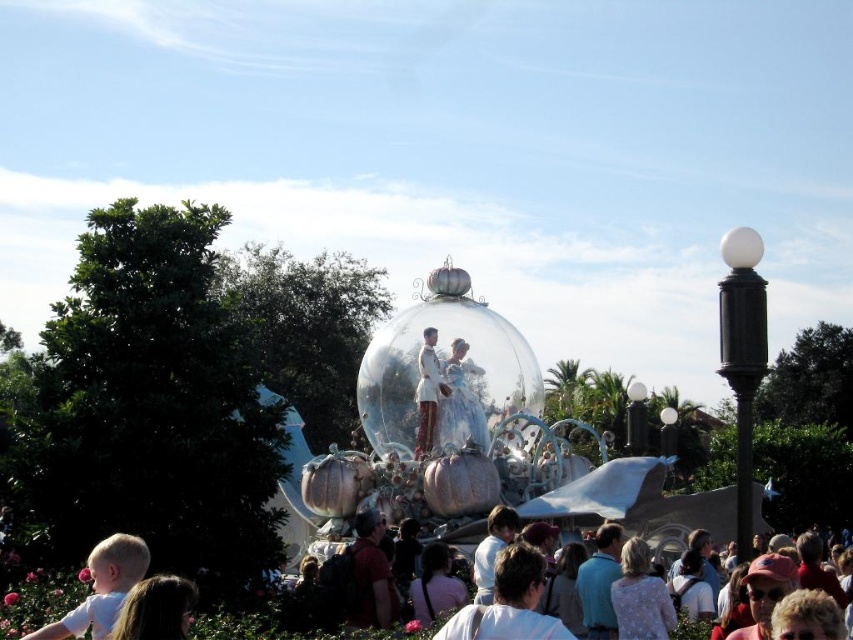
You are standing in the crowd at the theme park and notice two items at the center. Which item is closer to you between the white cotton shirt at center and the matte red backpack at center?

The white cotton shirt at center is closer to you since it is in front of the matte red backpack at center.

You are a photographer at the theme park and want to take a photo of the white cotton shirt at center and the matte red backpack at center. Which object should you focus on first if you want to capture both in a single shot without moving the camera?

The white cotton shirt at center is positioned under the matte red backpack at center, so you should focus on the matte red backpack at center first to ensure both are in frame.

You are a photographer at the theme park and need to capture a photo of both the white cotton shirt at center and the white satin dress at center. Which one should you focus on first if you want to ensure both are in frame without adjusting your camera angle?

The white cotton shirt at center is not as tall as the white satin dress at center, so you should focus on the white satin dress at center first to ensure it fits within the frame since it is taller.